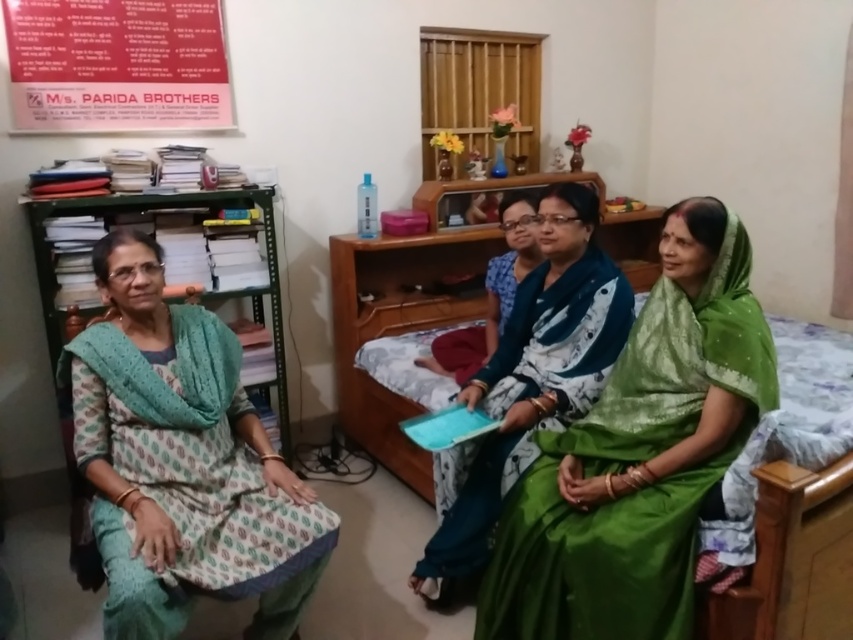
You are taking a photo of two points in the room. The first point is at coordinate point [701,385] and the second is at point [160,65]. Which point will appear larger in your photo?

Point [701,385] is closer to the camera than point [160,65], so it will appear larger in the photo.